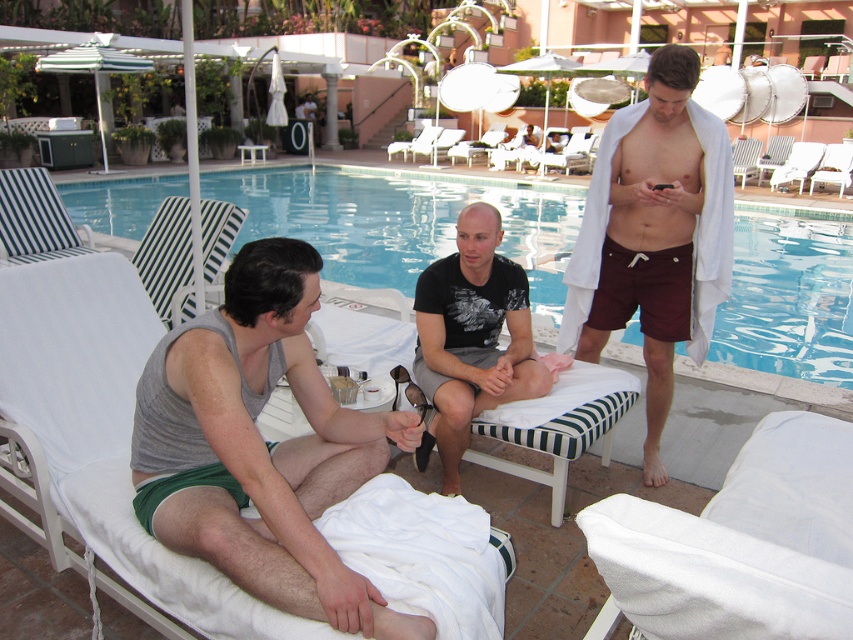
Between point (82, 182) and point (482, 348), which one is positioned in front?

Point (482, 348)

Which is in front, point (288, 189) or point (469, 220)?

Positioned in front is point (469, 220).

This screenshot has width=853, height=640. What are the coordinates of `blue tile swimming pool at center` in the screenshot? It's located at (x=396, y=224).

Between point (549, 220) and point (666, 284), which one is positioned behind?

Positioned behind is point (549, 220).

Who is lower down, blue tile swimming pool at center or maroon fabric shorts at right?

maroon fabric shorts at right is below.

Where is `blue tile swimming pool at center`? blue tile swimming pool at center is located at coordinates (396, 224).

Who is positioned more to the left, maroon fabric shorts at right or black matte t-shirt at center?

Positioned to the left is black matte t-shirt at center.

This screenshot has width=853, height=640. What do you see at coordinates (654, 234) in the screenshot?
I see `maroon fabric shorts at right` at bounding box center [654, 234].

Locate an element on the screen. The image size is (853, 640). maroon fabric shorts at right is located at coordinates (654, 234).